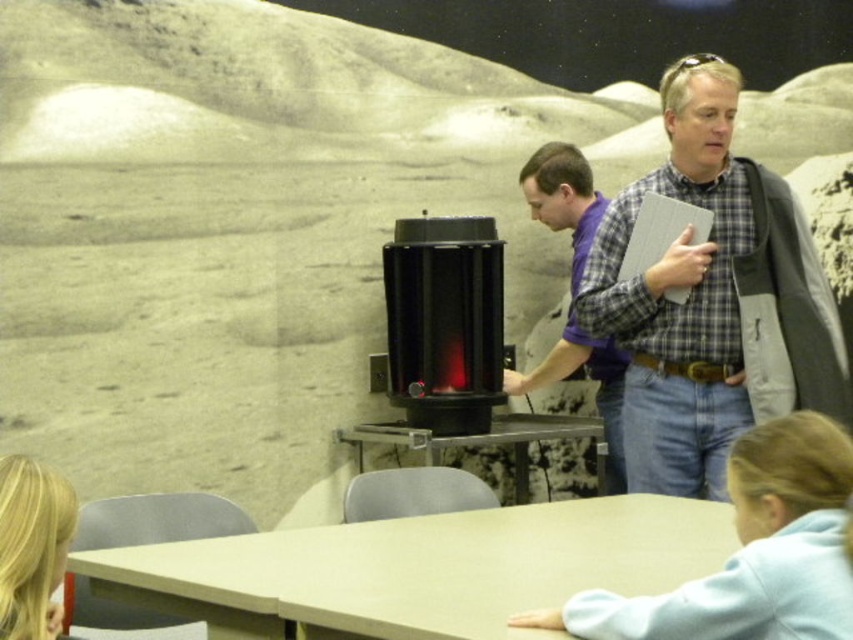
You are an event organizer who needs to arrange a photo shoot for the demonstration. The photographer mentioned that the plaid shirt at upper right and the smooth gray table at center must be visible in the frame. Considering their sizes, which object should you prioritize placing closer to the camera to ensure both are clearly visible?

The plaid shirt at upper right is larger in size than the smooth gray table at center, so you should prioritize placing the plaid shirt at upper right closer to the camera to ensure both objects are clearly visible in the frame.